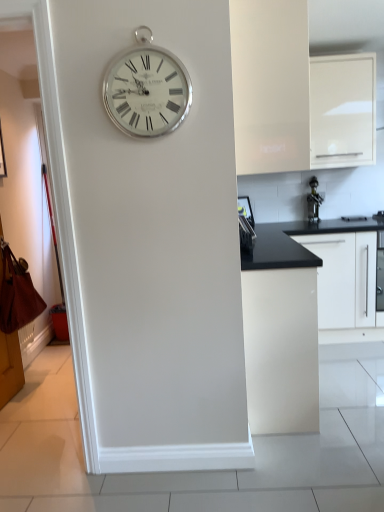
Question: Does white matte cabinet at upper center, positioned as the 1th cabinetry in left-to-right order, appear on the right side of silver metallic clock at upper center?

Choices:
 (A) yes
 (B) no

Answer: (A)

Question: Could silver metallic clock at upper center be considered to be inside white matte cabinet at upper center, which appears as the fourth cabinetry when viewed from the right?

Choices:
 (A) yes
 (B) no

Answer: (B)

Question: Does white matte cabinet at upper center, which appears as the fourth cabinetry when viewed from the right, touch silver metallic clock at upper center?

Choices:
 (A) no
 (B) yes

Answer: (A)

Question: Considering the relative positions of white matte cabinet at upper center, which appears as the fourth cabinetry when viewed from the right, and silver metallic clock at upper center in the image provided, is white matte cabinet at upper center, which appears as the fourth cabinetry when viewed from the right, in front of silver metallic clock at upper center?

Choices:
 (A) no
 (B) yes

Answer: (A)

Question: Is the depth of white matte cabinet at upper center, which appears as the fourth cabinetry when viewed from the right, greater than that of silver metallic clock at upper center?

Choices:
 (A) yes
 (B) no

Answer: (A)

Question: From a real-world perspective, relative to silver metallic clock at upper center, is satin black knife block at right, which appears as the 2th appliance when viewed from the right, vertically above or below?

Choices:
 (A) below
 (B) above

Answer: (A)

Question: From the image's perspective, is satin black knife block at right, positioned as the 2th appliance in back-to-front order, located above or below silver metallic clock at upper center?

Choices:
 (A) above
 (B) below

Answer: (B)

Question: Considering the relative positions of satin black knife block at right, positioned as the 2th appliance in back-to-front order, and silver metallic clock at upper center in the image provided, is satin black knife block at right, positioned as the 2th appliance in back-to-front order, to the left or to the right of silver metallic clock at upper center?

Choices:
 (A) right
 (B) left

Answer: (A)

Question: Considering the positions of point (251, 241) and point (167, 62), is point (251, 241) closer or farther from the camera than point (167, 62)?

Choices:
 (A) closer
 (B) farther

Answer: (B)

Question: Is point (241, 247) positioned closer to the camera than point (362, 247)?

Choices:
 (A) farther
 (B) closer

Answer: (B)

Question: In terms of height, does satin black knife block at right, which is the 1th appliance in front-to-back order, look taller or shorter compared to white matte cabinet at right, which is the 1th cabinetry in right-to-left order?

Choices:
 (A) short
 (B) tall

Answer: (A)

Question: Considering the positions of satin black knife block at right, positioned as the 2th appliance in back-to-front order, and white matte cabinet at right, acting as the 4th cabinetry starting from the left, in the image, is satin black knife block at right, positioned as the 2th appliance in back-to-front order, wider or thinner than white matte cabinet at right, acting as the 4th cabinetry starting from the left,?

Choices:
 (A) thin
 (B) wide

Answer: (A)

Question: From a real-world perspective, is satin black knife block at right, which is the 1th appliance in front-to-back order, above or below white matte cabinet at right, which is the 1th cabinetry in right-to-left order?

Choices:
 (A) below
 (B) above

Answer: (B)

Question: Is white matte cabinet at right, acting as the 4th cabinetry starting from the left, situated inside satin black knife block at right, which is the 1th appliance in front-to-back order, or outside?

Choices:
 (A) outside
 (B) inside

Answer: (A)

Question: Relative to satin black knife block at right, the first appliance when ordered from left to right, is white matte cabinet at right, which is the 1th cabinetry in right-to-left order, in front or behind?

Choices:
 (A) front
 (B) behind

Answer: (B)